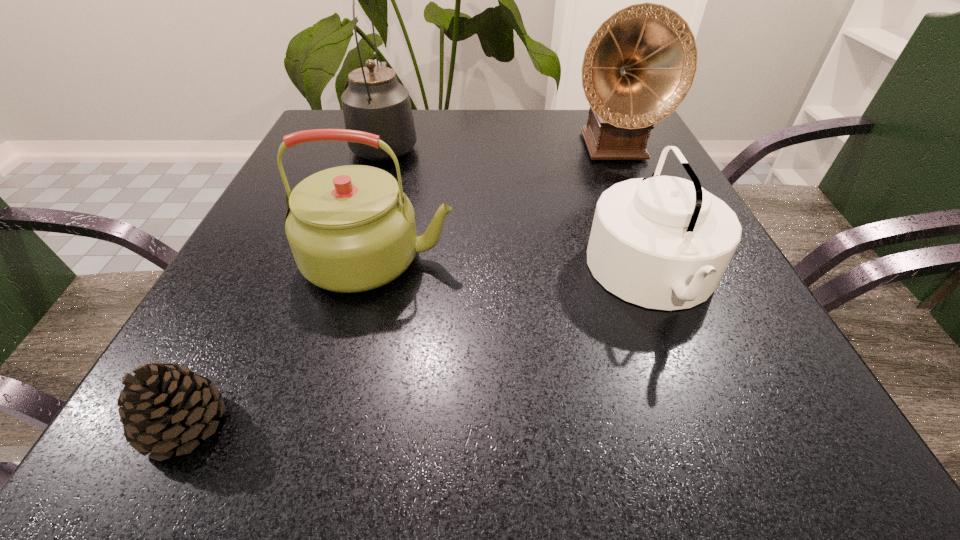
You are a GUI agent. You are given a task and a screenshot of the screen. Output one action in this format:
    pyautogui.click(x=<x>, y=<y>)
    Task: Click on the object situated at the near left corner
    
    Given the screenshot: What is the action you would take?
    pyautogui.click(x=164, y=406)

Find the location of `object at the far right corner`. object at the far right corner is located at coordinates (640, 64).

The width and height of the screenshot is (960, 540). Identify the location of free point at the far edge. (554, 130).

Locate an element on the screen. This screenshot has height=540, width=960. free space at the left edge is located at coordinates (270, 310).

Image resolution: width=960 pixels, height=540 pixels. Identify the location of free space at the right edge of the desktop. (605, 173).

This screenshot has width=960, height=540. I want to click on free space at the far left corner, so click(x=316, y=126).

In order to click on vacant space at the far right corner of the desktop in this screenshot , I will do `click(651, 136)`.

Find the location of `free region at the near right corner of the desktop`. free region at the near right corner of the desktop is located at coordinates (766, 414).

You are a GUI agent. You are given a task and a screenshot of the screen. Output one action in this format:
    pyautogui.click(x=<x>, y=<y>)
    Task: Click on the vacant space that is in between the shortest object and the phonograph record
    
    Given the screenshot: What is the action you would take?
    pyautogui.click(x=398, y=286)

Find the location of `free space that is in between the third tallest object and the rightmost kettle`. free space that is in between the third tallest object and the rightmost kettle is located at coordinates (516, 267).